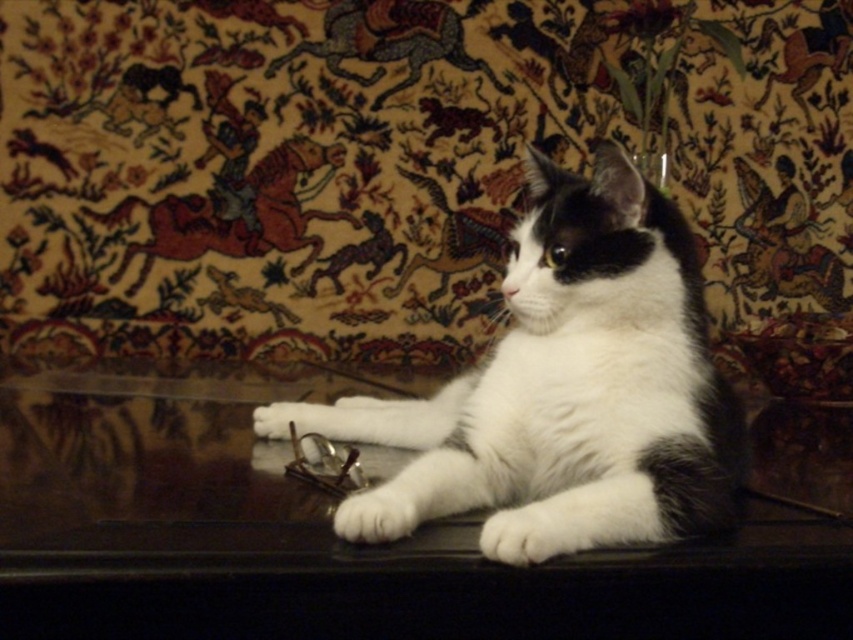
You are a photographer setting up a shot of the glossy dark wood table at center and the white fur paw at lower center. You want to focus on the table but ensure the paw is still visible. Which object should you position closer to the camera to achieve this?

To focus on the glossy dark wood table at center while keeping the white fur paw at lower center visible, position the glossy dark wood table at center closer to the camera since it is already closer to the viewer than the white fur paw at lower center.

You are a photographer trying to capture the white fur cat at center and the white fur at lower center in the same frame. Based on their heights, which one should you focus on first to ensure both are in focus?

The white fur cat at center is taller than the white fur at lower center, so you should focus on the white fur cat at center first to ensure both are in focus.